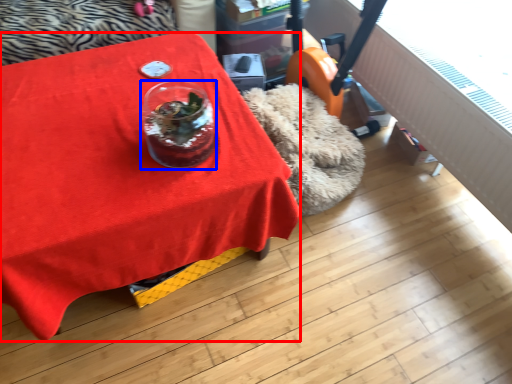
Question: Which point is further to the camera, table (highlighted by a red box) or glass vase (highlighted by a blue box)?

Choices:
 (A) table
 (B) glass vase

Answer: (B)